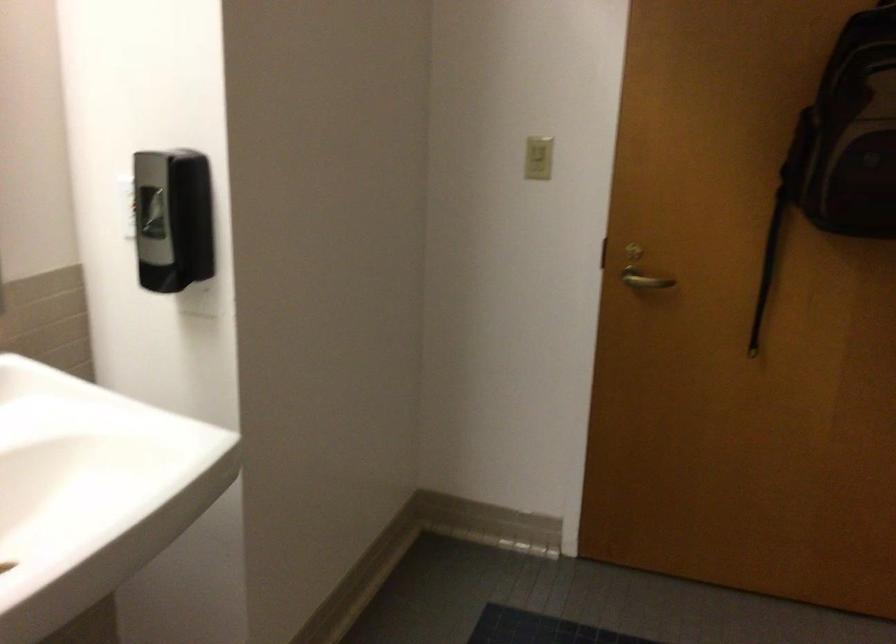
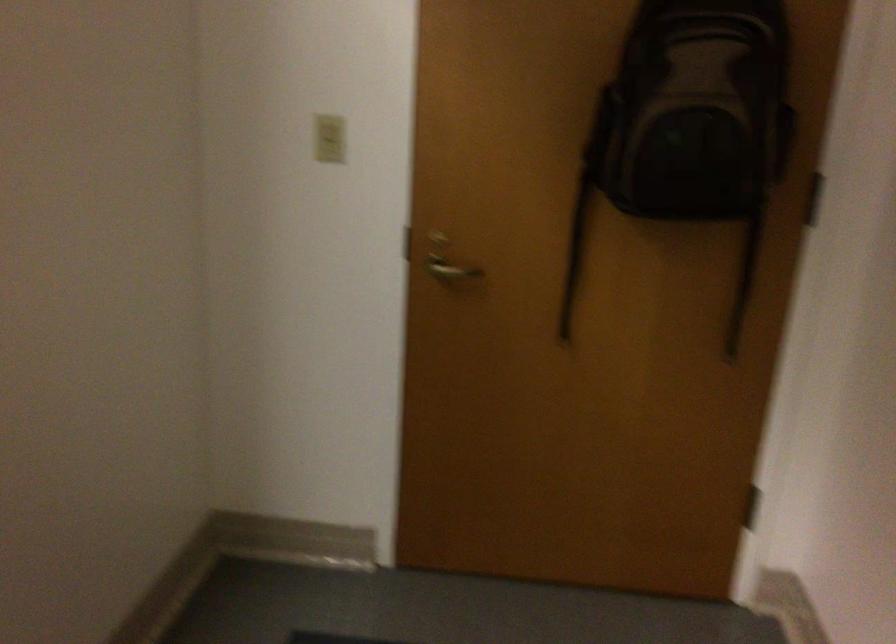
The images are taken continuously from a first-person perspective. In which direction are you moving?

The cameraman moved toward right, forward.